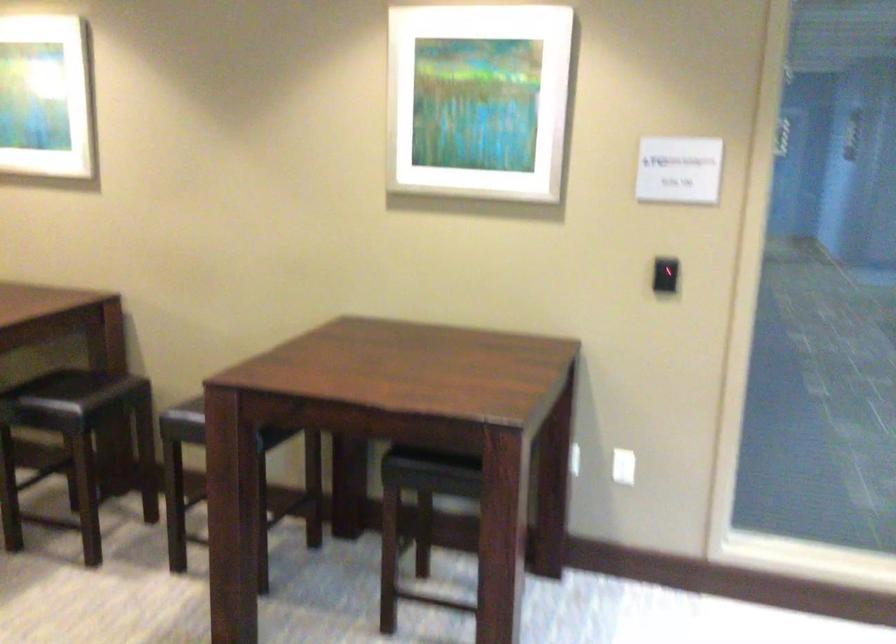
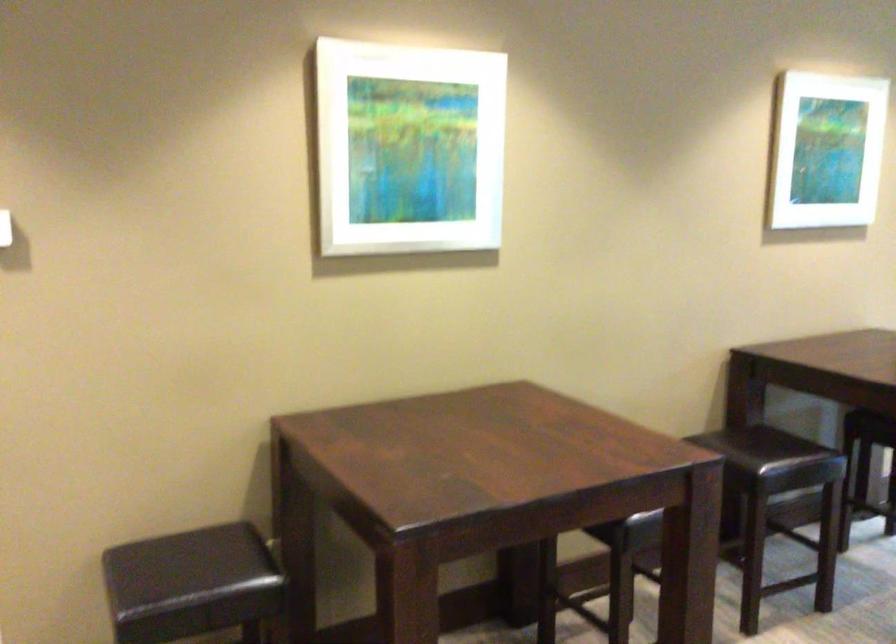
Question: I am providing you with two images of the same scene from different viewpoints. Which of the following objects are not visible in image2?

Choices:
 (A) white framed art
 (B) blue softener bottle
 (C) dark chair sitting surface
 (D) chair sitting surface

Answer: (D)